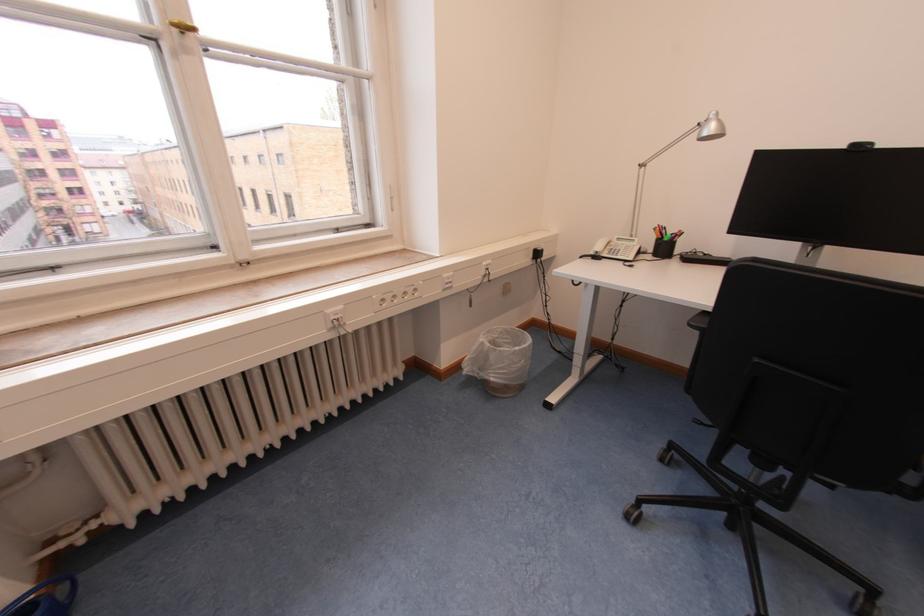
Image resolution: width=924 pixels, height=616 pixels. What are the coordinates of `silver lamp head` in the screenshot? It's located at (714, 127).